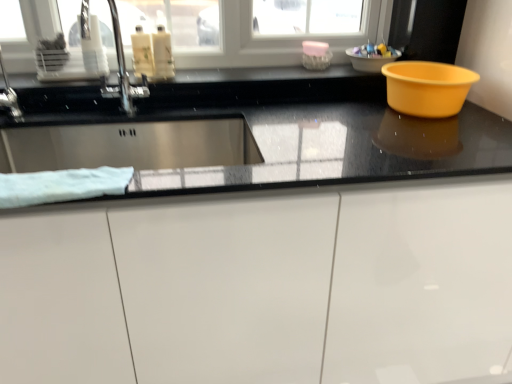
The image size is (512, 384). I want to click on free region under metallic faucet at upper left (from a real-world perspective), so click(123, 112).